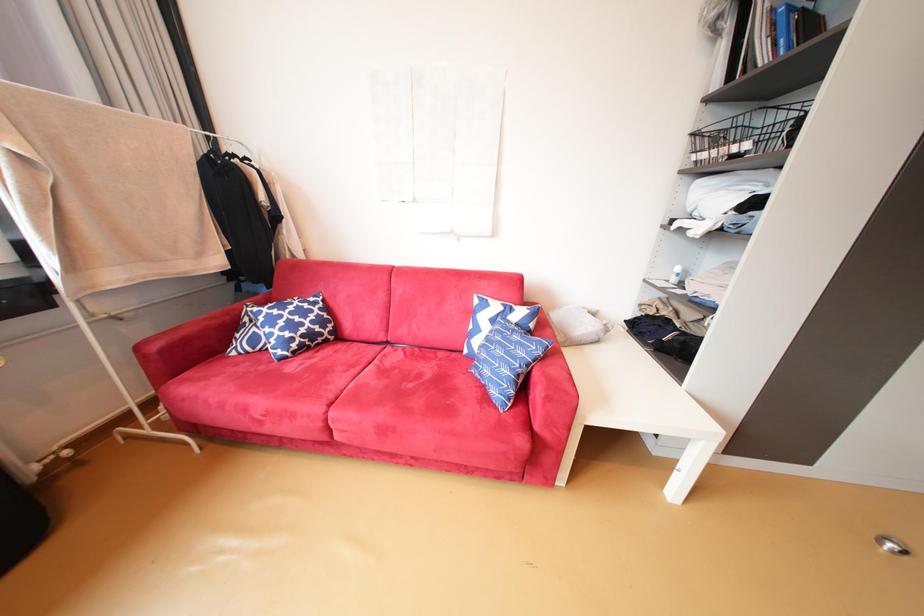
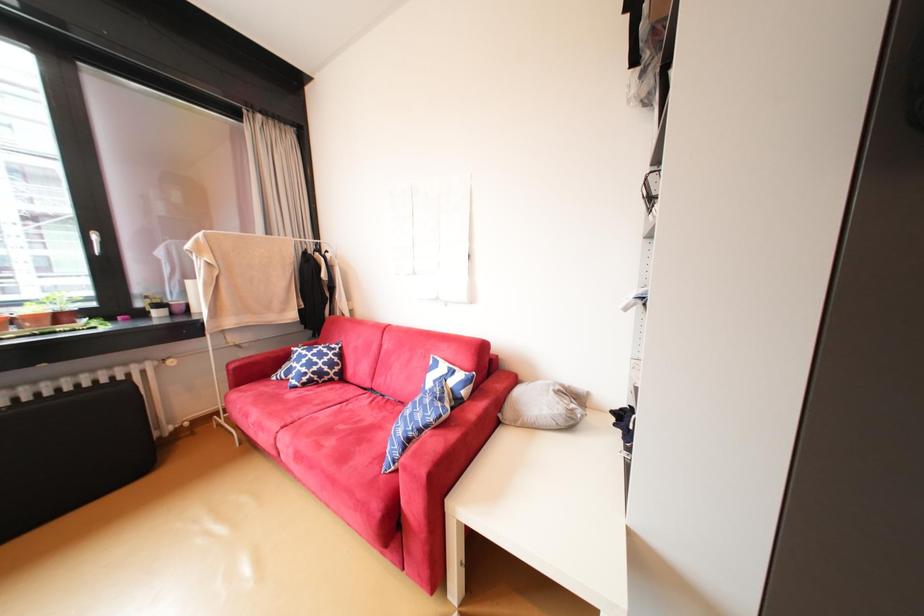
Question: The images are taken continuously from a first-person perspective. In which direction are you moving?

Choices:
 (A) Left
 (B) Right
 (C) Forward
 (D) Backward

Answer: (B)